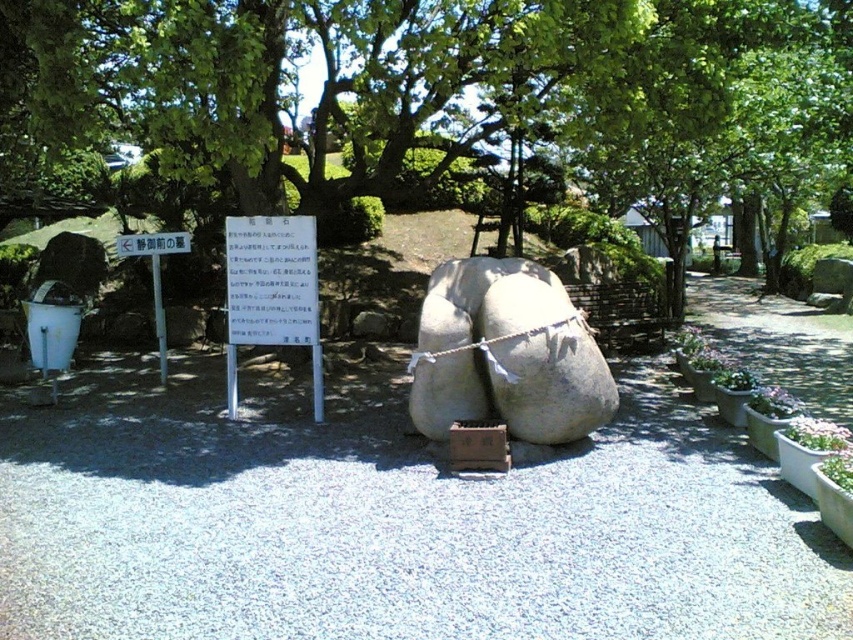
Question: Does white paper sign at center have a smaller size compared to white paper sign at upper center?

Choices:
 (A) no
 (B) yes

Answer: (A)

Question: Which object appears farthest from the camera in this image?

Choices:
 (A) white paper sign at center
 (B) white paper sign at upper center

Answer: (B)

Question: Does white paper sign at center have a greater width compared to white paper sign at upper center?

Choices:
 (A) yes
 (B) no

Answer: (A)

Question: Which object appears farthest from the camera in this image?

Choices:
 (A) white paper sign at center
 (B) white paper sign at upper center

Answer: (B)

Question: Does white paper sign at center have a lesser width compared to white paper sign at upper center?

Choices:
 (A) no
 (B) yes

Answer: (A)